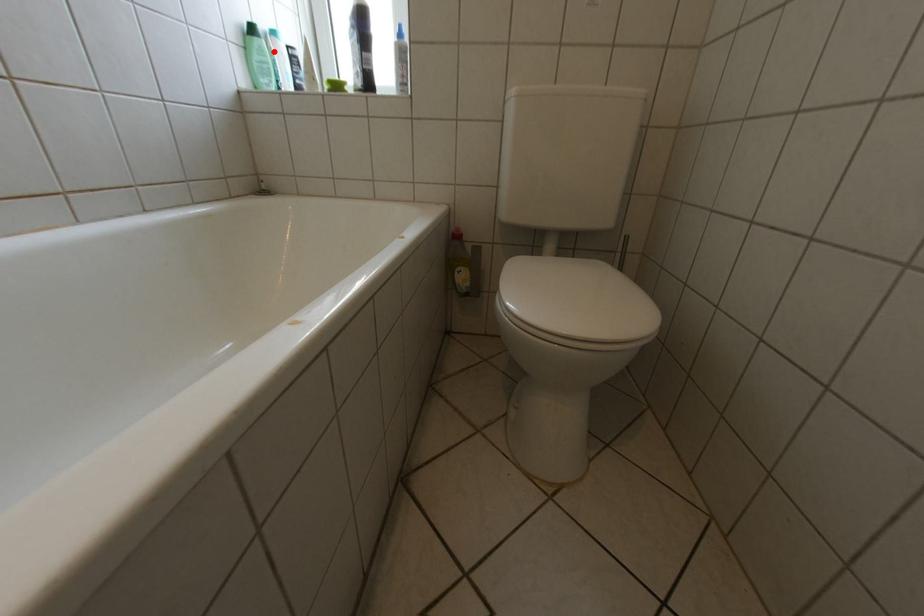
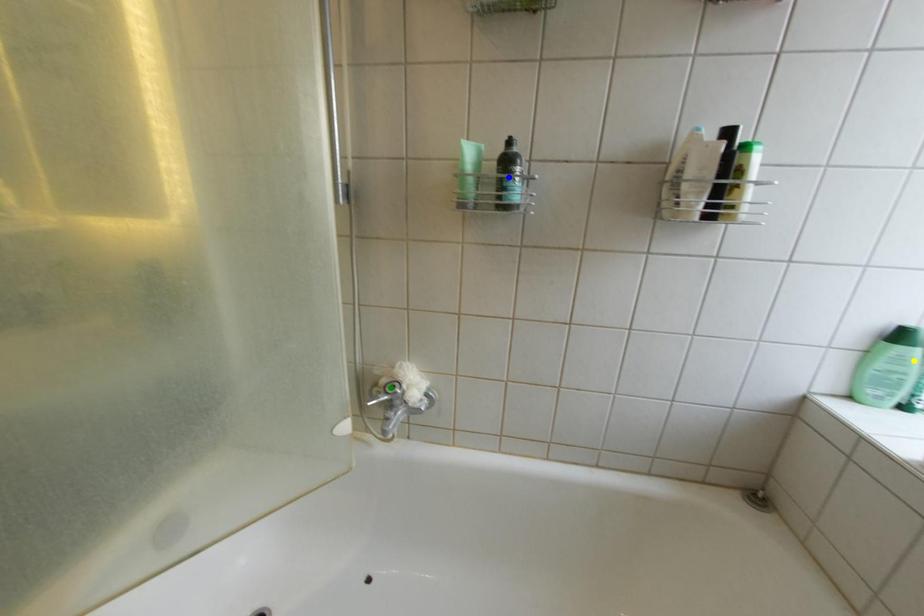
Question: I am providing you with two images of the same scene from different viewpoints. A red point is marked on the first image. You are given multiple points on the second image. Which spot in image 2 lines up with the point in image 1?

Choices:
 (A) yellow point
 (B) blue point
 (C) green point

Answer: (A)